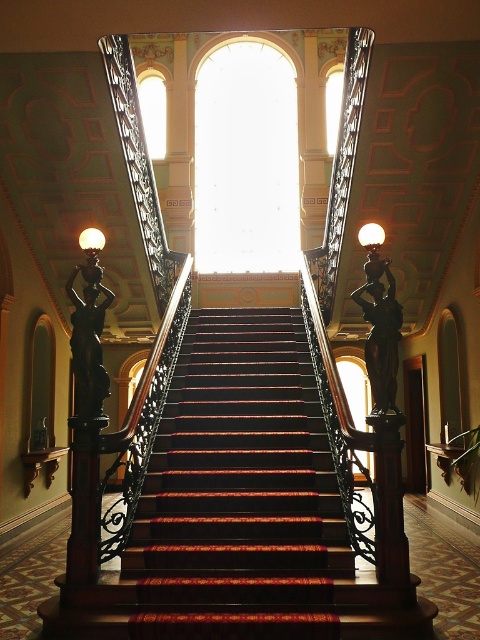
You are an interior designer assessing the space. You need to determine if the wooden staircase at center can fit under a new chandelier that has a height requirement of 2 meters. Given the height of the black polished statue at left, can the staircase accommodate the chandelier?

The wooden staircase at center is shorter than the black polished statue at left. Since the statue is taller than the staircase, and the chandelier requires 2 meters, we need to know the statue height. However, the description doesn not provide exact measurements. Thus, insufficient info to determine.

You are standing at the bottom of the wooden staircase at center. Looking up, where would you see the top of the staircase located in relation to your current position?

The wooden staircase at center is located at point (x=248, y=509). Since you are at the bottom, the top of the staircase would be above your current position.

You are standing at the bottom of the wooden staircase at center and want to walk towards the black polished statue at left. Can you see the statue clearly from your current position?

The wooden staircase at center is in front of the black polished statue at left, so you cannot see the statue clearly from your current position because the staircase is blocking your view.